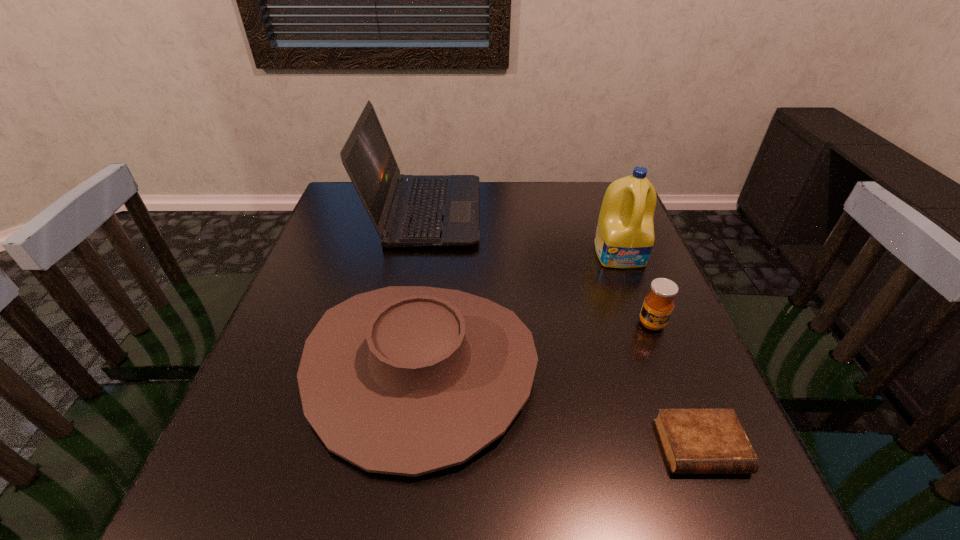
Find the location of `object situated at the near right corner`. object situated at the near right corner is located at coordinates (695, 441).

Identify the location of vacant space at the far edge. This screenshot has width=960, height=540. (490, 208).

Locate an element on the screen. vacant space at the near edge of the desktop is located at coordinates (478, 525).

The width and height of the screenshot is (960, 540). What are the coordinates of `free space at the left edge of the desktop` in the screenshot? It's located at (361, 272).

Locate an element on the screen. This screenshot has height=540, width=960. vacant space at the right edge is located at coordinates (633, 383).

This screenshot has width=960, height=540. Identify the location of free space at the far left corner. (356, 206).

Locate an element on the screen. This screenshot has height=540, width=960. empty space between the laptop_computer and the diary is located at coordinates (564, 329).

The width and height of the screenshot is (960, 540). Find the location of `free spot between the cowboy hat and the detergent`. free spot between the cowboy hat and the detergent is located at coordinates (521, 311).

Where is `vacant space in between the cowboy hat and the honey`? Image resolution: width=960 pixels, height=540 pixels. vacant space in between the cowboy hat and the honey is located at coordinates (537, 346).

Where is `vacant space in between the honey and the cowboy hat`? This screenshot has width=960, height=540. vacant space in between the honey and the cowboy hat is located at coordinates (537, 346).